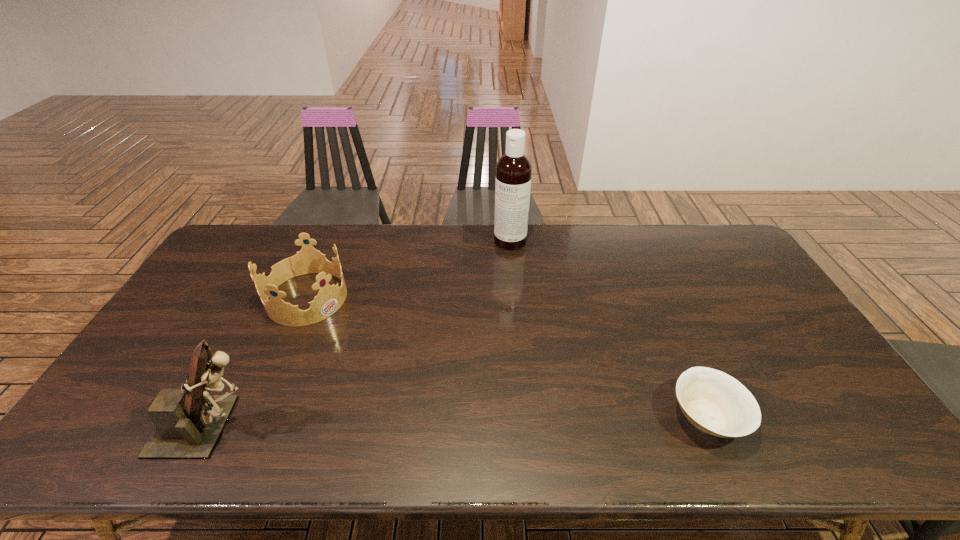
The height and width of the screenshot is (540, 960). Find the location of `vacant space on the desktop that is between the third shortest object and the bowl and is positioned on the front-facing side of the second farthest object`. vacant space on the desktop that is between the third shortest object and the bowl and is positioned on the front-facing side of the second farthest object is located at coordinates (502, 421).

The width and height of the screenshot is (960, 540). Identify the location of free space on the desktop that is between the figurine and the rightmost object and is positioned on the label side of the third object from left to right. (417, 422).